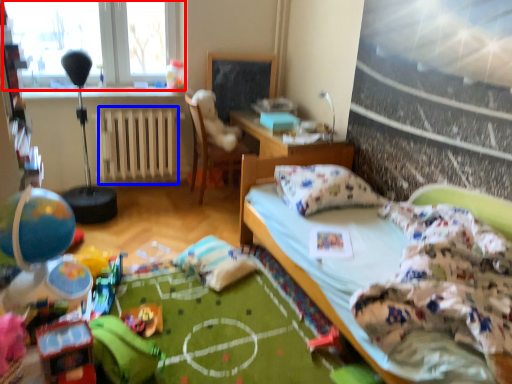
Question: Which object appears closest to the camera in this image, window (highlighted by a red box) or radiator (highlighted by a blue box)?

Choices:
 (A) window
 (B) radiator

Answer: (A)